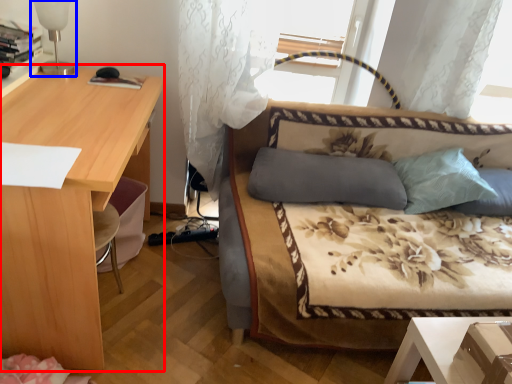
Question: Which of the following is the closest to the observer, desk (highlighted by a red box) or table lamp (highlighted by a blue box)?

Choices:
 (A) desk
 (B) table lamp

Answer: (A)